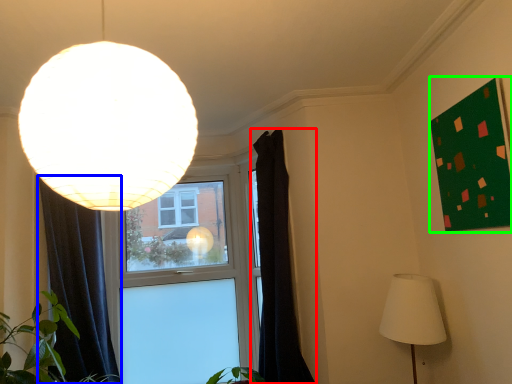
Question: Based on their relative distances, which object is farther from curtain (highlighted by a red box)? Choose from curtain (highlighted by a blue box) and bulletin board (highlighted by a green box).

Choices:
 (A) curtain
 (B) bulletin board

Answer: (A)